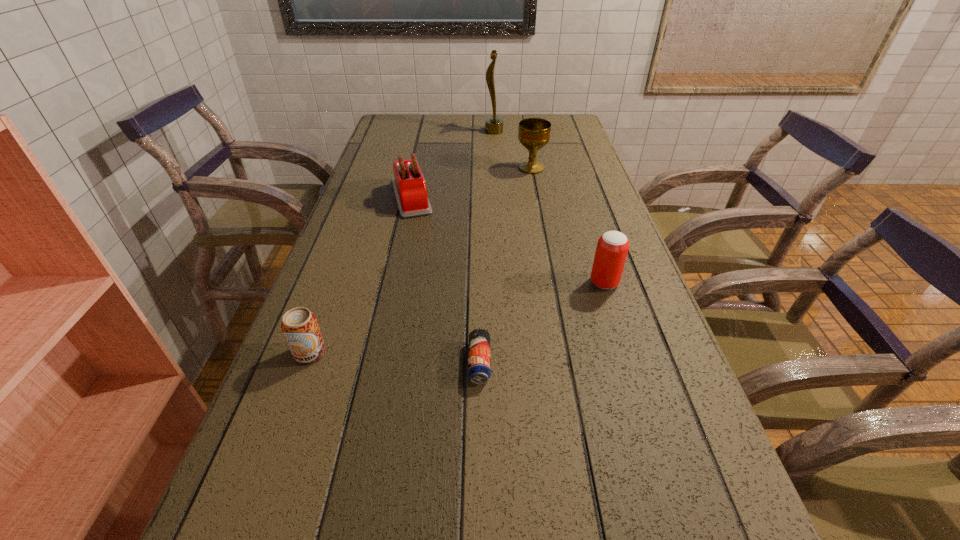
The height and width of the screenshot is (540, 960). Find the location of `blank region between the second beer can from left to right and the award`. blank region between the second beer can from left to right and the award is located at coordinates (487, 247).

At what (x,y) coordinates should I click in order to perform the action: click on vacant point located between the second beer can from right to left and the leftmost beer can. Please return your answer as a coordinate pair (x, y). This screenshot has width=960, height=540. Looking at the image, I should click on (395, 357).

Identify the location of free space between the fifth nearest object and the leftmost object. (420, 260).

The height and width of the screenshot is (540, 960). In order to click on free space between the fifth nearest object and the second shortest object in this screenshot , I will do `click(420, 260)`.

Where is `free area in between the fourth nearest object and the second beer can from left to right`? This screenshot has width=960, height=540. free area in between the fourth nearest object and the second beer can from left to right is located at coordinates (445, 280).

Image resolution: width=960 pixels, height=540 pixels. I want to click on vacant space that's between the rightmost object and the shortest beer can, so click(541, 322).

You are a GUI agent. You are given a task and a screenshot of the screen. Output one action in this format:
    pyautogui.click(x=<x>, y=<y>)
    Task: Click on the vacant space that's between the third farthest object and the second beer can from left to right
    Image resolution: width=960 pixels, height=540 pixels.
    Given the screenshot: What is the action you would take?
    pyautogui.click(x=445, y=280)

Identify the location of empty space between the second tallest beer can and the third nearest object. The height and width of the screenshot is (540, 960). (457, 318).

Locate an element on the screen. This screenshot has width=960, height=540. object that stands as the second closest to the shortest object is located at coordinates (300, 327).

The width and height of the screenshot is (960, 540). I want to click on the fifth closest object to the tallest object, so click(300, 327).